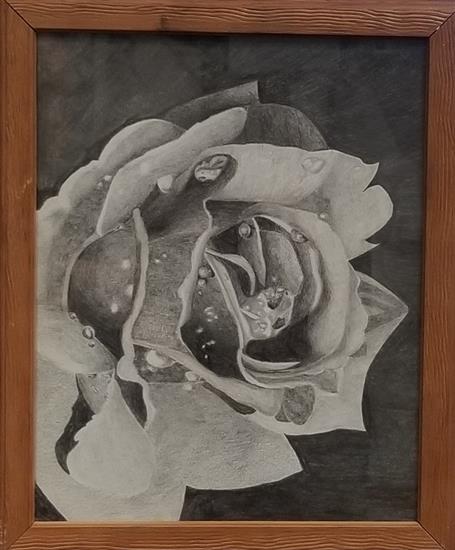
The width and height of the screenshot is (455, 550). Identify the location of right side of picture frame. (437, 295).